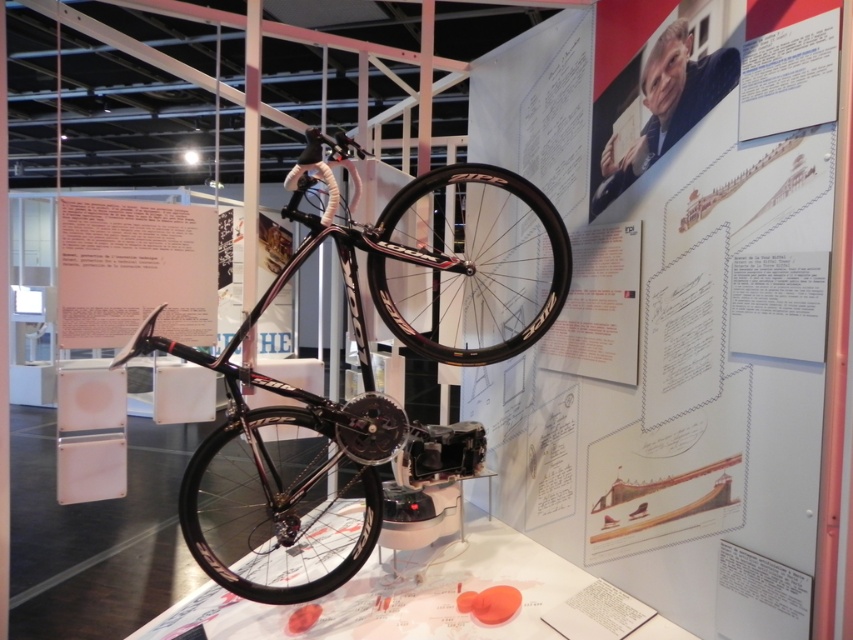
Question: Which point is farther to the camera?

Choices:
 (A) (222, 577)
 (B) (343, 556)
 (C) (439, 248)

Answer: (C)

Question: Does white paper poster at upper center appear under black glossy wheel at center?

Choices:
 (A) yes
 (B) no

Answer: (A)

Question: Is the position of black glossy wheel at center more distant than that of white paper at center?

Choices:
 (A) no
 (B) yes

Answer: (B)

Question: Is white paper poster at upper center bigger than black glossy wheel at center?

Choices:
 (A) yes
 (B) no

Answer: (A)

Question: Among these objects, which one is nearest to the camera?

Choices:
 (A) black glossy wheel at center
 (B) white paper at center
 (C) black glossy bicycle wheel at center

Answer: (B)

Question: Which of these objects is positioned closest to the black glossy wheel at center?

Choices:
 (A) white paper at center
 (B) shiny black bicycle at center

Answer: (B)